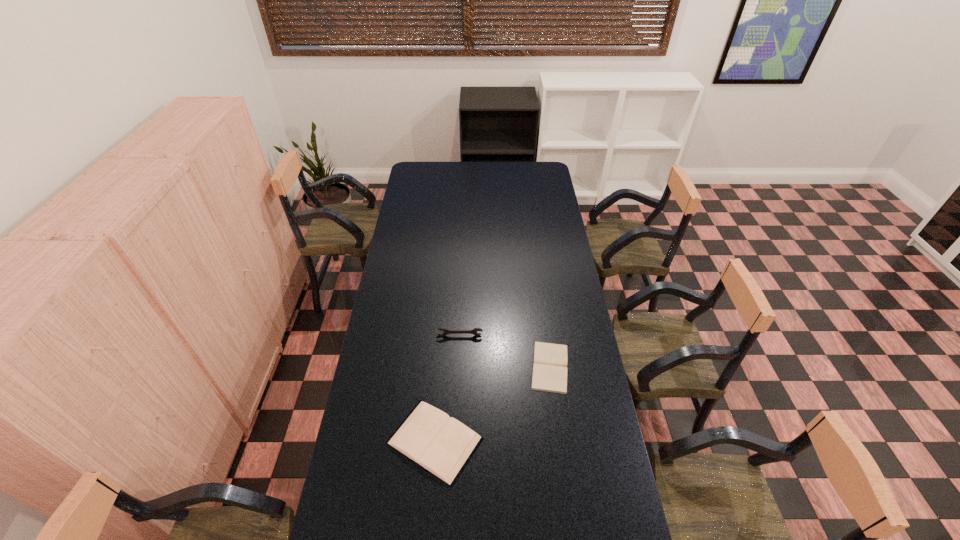
Where is `object at the right edge`? object at the right edge is located at coordinates (549, 370).

Where is `vacant area at the left edge`? vacant area at the left edge is located at coordinates (414, 294).

Where is `free space at the right edge of the desktop`? free space at the right edge of the desktop is located at coordinates (551, 253).

The height and width of the screenshot is (540, 960). I want to click on free area in between the farthest object and the Bible, so click(505, 351).

The height and width of the screenshot is (540, 960). What are the coordinates of `vacant region between the nearest object and the rightmost object` in the screenshot? It's located at (492, 403).

The image size is (960, 540). What are the coordinates of `free space that is in between the shortest object and the nearest object` in the screenshot? It's located at point(492,403).

Image resolution: width=960 pixels, height=540 pixels. Identify the location of vacant area that lies between the farthest object and the shortest object. (505, 351).

Locate an element on the screen. This screenshot has width=960, height=540. blank region between the hardback book and the wrench is located at coordinates (447, 388).

This screenshot has width=960, height=540. Find the location of `free space between the second tallest object and the Bible`. free space between the second tallest object and the Bible is located at coordinates (492, 403).

Image resolution: width=960 pixels, height=540 pixels. Find the location of `empty location between the tallest object and the Bible`. empty location between the tallest object and the Bible is located at coordinates (505, 351).